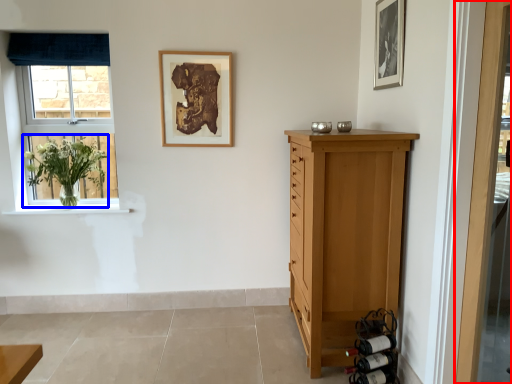
Question: Among these objects, which one is farthest to the camera, door (highlighted by a red box) or floral arrangement (highlighted by a blue box)?

Choices:
 (A) door
 (B) floral arrangement

Answer: (B)